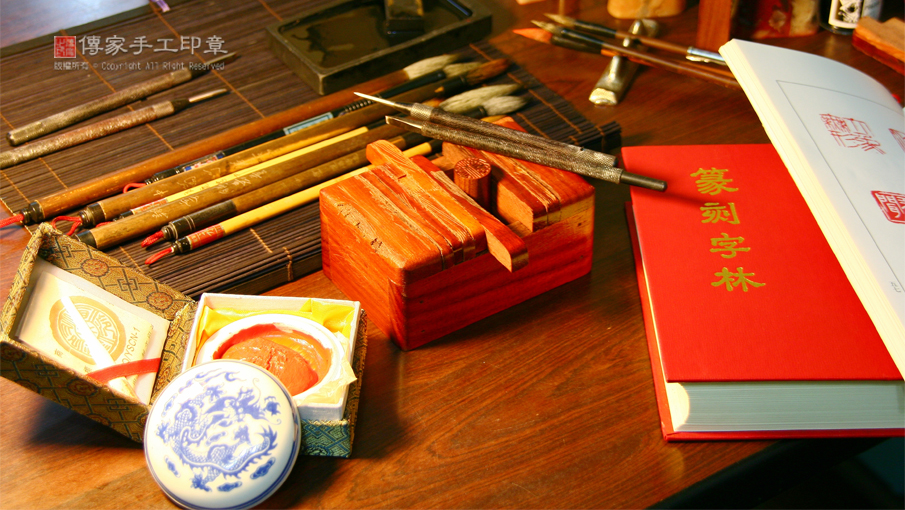
Identify the location of metal paintbrush holder. point(606,82).